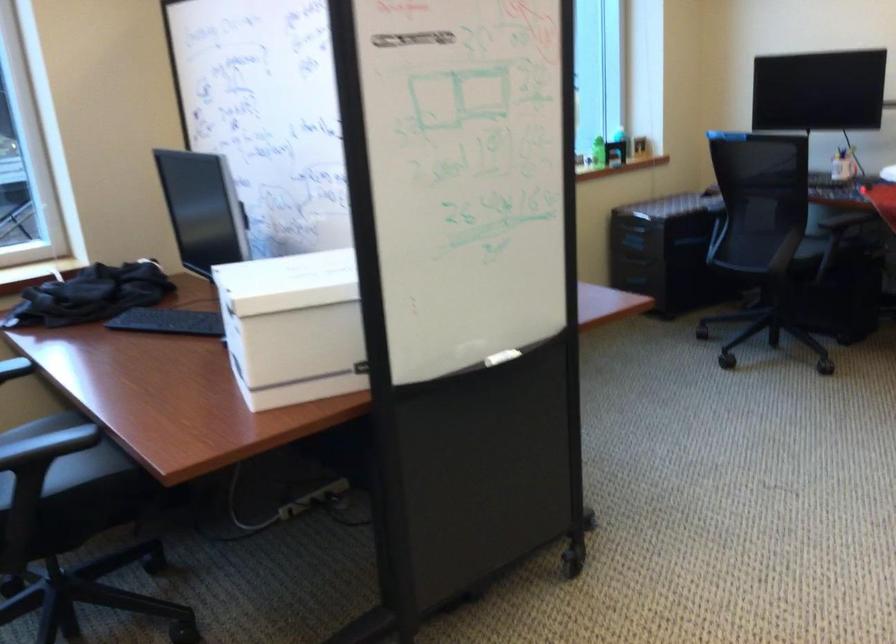
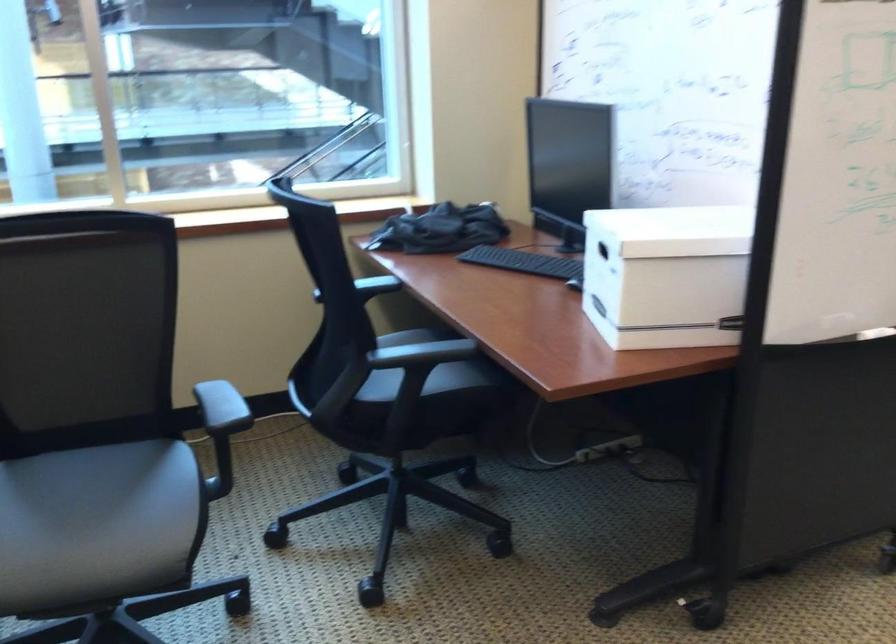
What movement of the cameraman would produce the second image?

The cameraman moved toward left, backward.